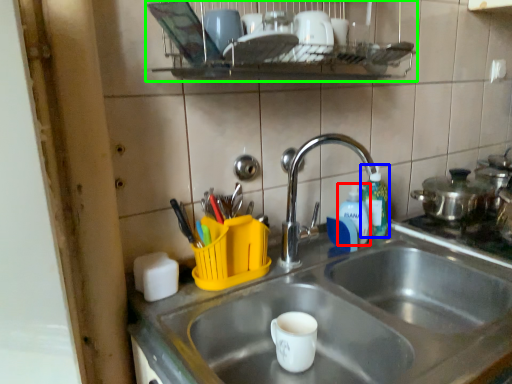
Question: Which object is positioned closest to bottle (highlighted by a red box)? Select from bottle (highlighted by a blue box) and shelf (highlighted by a green box).

Choices:
 (A) bottle
 (B) shelf

Answer: (A)